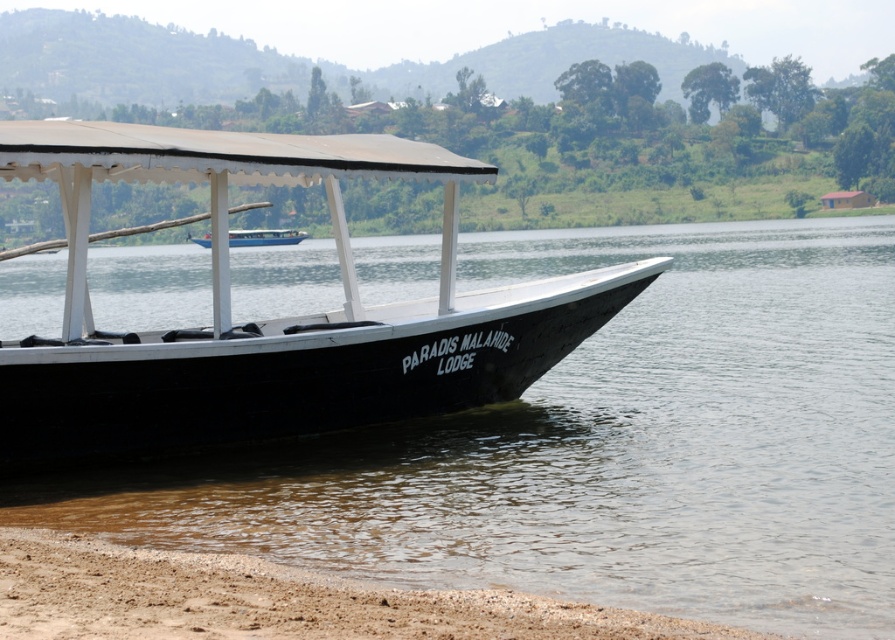
Describe the element at coordinates (599, 445) in the screenshot. The width and height of the screenshot is (895, 640). I see `clear water at boat right` at that location.

Image resolution: width=895 pixels, height=640 pixels. Identify the location of clear water at boat right. (599, 445).

Who is taller, clear water at boat right or blue glossy boat at center?

clear water at boat right

Is point (786, 371) positioned before point (268, 228)?

Yes, point (786, 371) is in front of point (268, 228).

Where is `clear water at boat right`? The image size is (895, 640). clear water at boat right is located at coordinates (599, 445).

Which is more to the right, clear water at boat right or brown sandy shore at lower left?

clear water at boat right

Does clear water at boat right have a larger size compared to brown sandy shore at lower left?

Indeed, clear water at boat right has a larger size compared to brown sandy shore at lower left.

Where is `clear water at boat right`? clear water at boat right is located at coordinates click(599, 445).